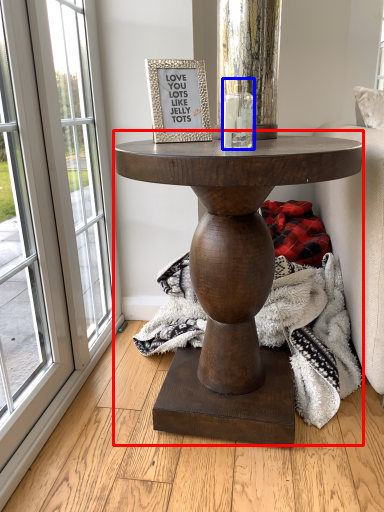
Question: Which object is closer to the camera taking this photo, table (highlighted by a red box) or candle holder (highlighted by a blue box)?

Choices:
 (A) table
 (B) candle holder

Answer: (A)